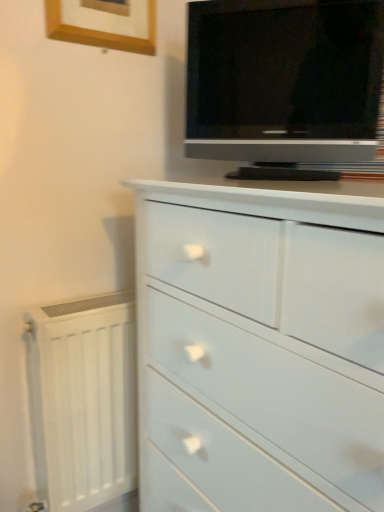
Measure the distance between point [68,31] and camera.

Point [68,31] and camera are 35.28 inches apart from each other.

What do you see at coordinates (260, 347) in the screenshot?
I see `white glossy chest of drawers at center` at bounding box center [260, 347].

Describe the element at coordinates (285, 81) in the screenshot. This screenshot has height=512, width=384. I see `matte black tv at upper right` at that location.

At what (x,y) coordinates should I click in order to perform the action: click on white painted radiator at lower left. Please return your answer as a coordinate pair (x, y). Image resolution: width=384 pixels, height=512 pixels. Looking at the image, I should click on (83, 400).

Is the position of matte black tv at upper right less distant than that of wooden picture frame at upper left?

→ Yes.

Looking at this image, who is bigger, matte black tv at upper right or wooden picture frame at upper left?

With larger size is matte black tv at upper right.

Is matte black tv at upper right inside the boundaries of wooden picture frame at upper left, or outside?

matte black tv at upper right is not inside wooden picture frame at upper left, it's outside.

Considering the relative sizes of white glossy chest of drawers at center and white painted radiator at lower left in the image provided, is white glossy chest of drawers at center shorter than white painted radiator at lower left?

Incorrect, the height of white glossy chest of drawers at center does not fall short of that of white painted radiator at lower left.

How distant is white glossy chest of drawers at center from white painted radiator at lower left?

white glossy chest of drawers at center is 13.26 inches away from white painted radiator at lower left.

Is white glossy chest of drawers at center smaller than white painted radiator at lower left?

No, white glossy chest of drawers at center is not smaller than white painted radiator at lower left.

Looking at this image, can you confirm if white painted radiator at lower left is positioned to the left of wooden picture frame at upper left?

Yes.

Is white painted radiator at lower left with wooden picture frame at upper left?

They are not placed beside each other.

Find the location of `picture frame located above the white painted radiator at lower left (from the image's perspective)`. picture frame located above the white painted radiator at lower left (from the image's perspective) is located at coordinates (104, 23).

Is white painted radiator at lower left taller than wooden picture frame at upper left?

Yes.

Are wooden picture frame at upper left and white glossy chest of drawers at center far apart?

wooden picture frame at upper left is near white glossy chest of drawers at center, not far away.

Can you confirm if wooden picture frame at upper left is bigger than white glossy chest of drawers at center?

Actually, wooden picture frame at upper left might be smaller than white glossy chest of drawers at center.

In terms of height, does wooden picture frame at upper left look taller or shorter compared to white glossy chest of drawers at center?

Clearly, wooden picture frame at upper left is shorter compared to white glossy chest of drawers at center.

Would you say matte black tv at upper right is inside or outside white painted radiator at lower left?

The correct answer is: outside.

Could you tell me if matte black tv at upper right is facing white painted radiator at lower left?

No, matte black tv at upper right is not turned towards white painted radiator at lower left.

Where is `radiator behind the matte black tv at upper right`? Image resolution: width=384 pixels, height=512 pixels. radiator behind the matte black tv at upper right is located at coordinates (83, 400).

Is point (104, 24) closer or farther from the camera than point (355, 29)?

Point (104, 24).

Considering the sizes of objects wooden picture frame at upper left and matte black tv at upper right in the image provided, who is bigger, wooden picture frame at upper left or matte black tv at upper right?

matte black tv at upper right.

Is there a large distance between wooden picture frame at upper left and matte black tv at upper right?

Actually, wooden picture frame at upper left and matte black tv at upper right are a little close together.

Considering the points (313, 229) and (371, 66), which point is in front, point (313, 229) or point (371, 66)?

The point (313, 229) is more forward.

How distant is white glossy chest of drawers at center from matte black tv at upper right?

15.28 inches.

Is the position of white glossy chest of drawers at center less distant than that of matte black tv at upper right?

Yes, white glossy chest of drawers at center is closer to the camera.

Could you tell me if white glossy chest of drawers at center is turned towards matte black tv at upper right?

No, white glossy chest of drawers at center is not turned towards matte black tv at upper right.

You are a GUI agent. You are given a task and a screenshot of the screen. Output one action in this format:
    pyautogui.click(x=<x>, y=<y>)
    Task: Click on the television beneath the wooden picture frame at upper left (from a real-world perspective)
    The image size is (384, 512).
    Given the screenshot: What is the action you would take?
    285,81

In the image, there is a white glossy chest of drawers at center. At what (x,y) coordinates should I click in order to perform the action: click on radiator below it (from the image's perspective). Please return your answer as a coordinate pair (x, y). Looking at the image, I should click on (83, 400).

When comparing their distances from wooden picture frame at upper left, does white painted radiator at lower left or matte black tv at upper right seem further?

white painted radiator at lower left is further to wooden picture frame at upper left.

Based on their spatial positions, is white glossy chest of drawers at center or white painted radiator at lower left closer to matte black tv at upper right?

Based on the image, white glossy chest of drawers at center appears to be nearer to matte black tv at upper right.

Estimate the real-world distances between objects in this image. Which object is closer to white painted radiator at lower left, white glossy chest of drawers at center or wooden picture frame at upper left?

Among the two, white glossy chest of drawers at center is located nearer to white painted radiator at lower left.

Based on their spatial positions, is wooden picture frame at upper left or white painted radiator at lower left further from matte black tv at upper right?

The object further to matte black tv at upper right is white painted radiator at lower left.

Estimate the real-world distances between objects in this image. Which object is further from white glossy chest of drawers at center, matte black tv at upper right or wooden picture frame at upper left?

wooden picture frame at upper left lies further to white glossy chest of drawers at center than the other object.

Which object lies further to the anchor point white painted radiator at lower left, white glossy chest of drawers at center or matte black tv at upper right?

Based on the image, matte black tv at upper right appears to be further to white painted radiator at lower left.

Looking at the image, which one is located closer to matte black tv at upper right, white glossy chest of drawers at center or wooden picture frame at upper left?

wooden picture frame at upper left is positioned closer to the anchor matte black tv at upper right.

Based on their spatial positions, is white painted radiator at lower left or wooden picture frame at upper left further from white glossy chest of drawers at center?

Among the two, wooden picture frame at upper left is located further to white glossy chest of drawers at center.

Locate an element on the screen. This screenshot has height=512, width=384. television that lies between wooden picture frame at upper left and white painted radiator at lower left from top to bottom is located at coordinates (285, 81).

Where is `television that lies between wooden picture frame at upper left and white glossy chest of drawers at center from top to bottom`? The width and height of the screenshot is (384, 512). television that lies between wooden picture frame at upper left and white glossy chest of drawers at center from top to bottom is located at coordinates (285, 81).

You are a GUI agent. You are given a task and a screenshot of the screen. Output one action in this format:
    pyautogui.click(x=<x>, y=<y>)
    Task: Click on the chest of drawers between matte black tv at upper right and white painted radiator at lower left in the vertical direction
    Image resolution: width=384 pixels, height=512 pixels.
    Given the screenshot: What is the action you would take?
    pyautogui.click(x=260, y=347)

At what (x,y) coordinates should I click in order to perform the action: click on chest of drawers between wooden picture frame at upper left and white painted radiator at lower left in the up-down direction. Please return your answer as a coordinate pair (x, y). The width and height of the screenshot is (384, 512). Looking at the image, I should click on (260, 347).